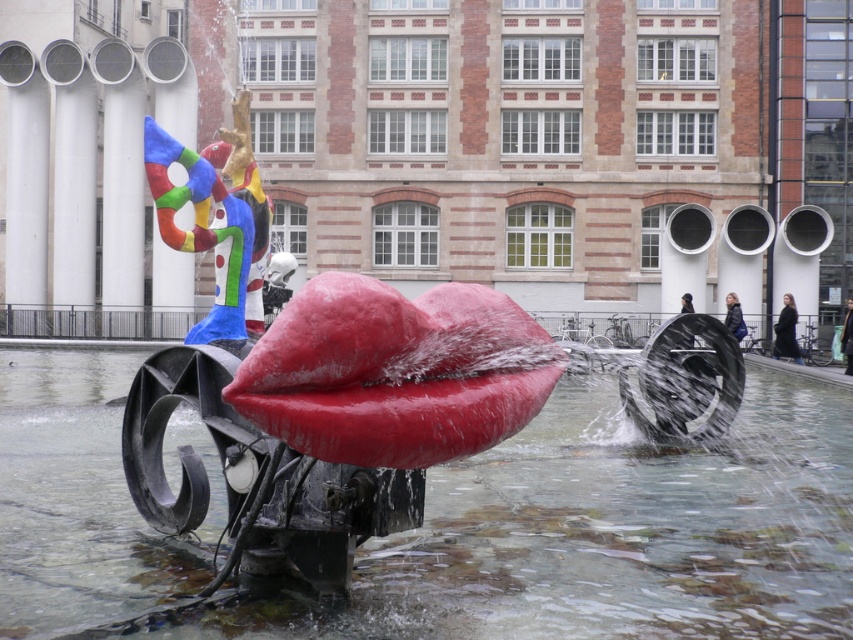
Question: Is glossy water at lips center wider than dark blue leather jacket at center?

Choices:
 (A) yes
 (B) no

Answer: (A)

Question: Can you confirm if glossy water at lips center is positioned below dark gray coat at lower right?

Choices:
 (A) no
 (B) yes

Answer: (B)

Question: Among these objects, which one is nearest to the camera?

Choices:
 (A) dark hair at center
 (B) dark blue leather jacket at center
 (C) dark hair person at center
 (D) dark gray coat at lower right

Answer: (B)

Question: Among these objects, which one is farthest from the camera?

Choices:
 (A) dark hair at center
 (B) glossy water at lips center
 (C) dark blue leather jacket at center
 (D) dark hair person at center

Answer: (D)

Question: Which object is closer to the camera taking this photo?

Choices:
 (A) dark hair person at center
 (B) dark hair at center
 (C) dark blue leather jacket at center

Answer: (C)

Question: Is glossy water at lips center further to the viewer compared to dark gray coat at lower right?

Choices:
 (A) yes
 (B) no

Answer: (B)